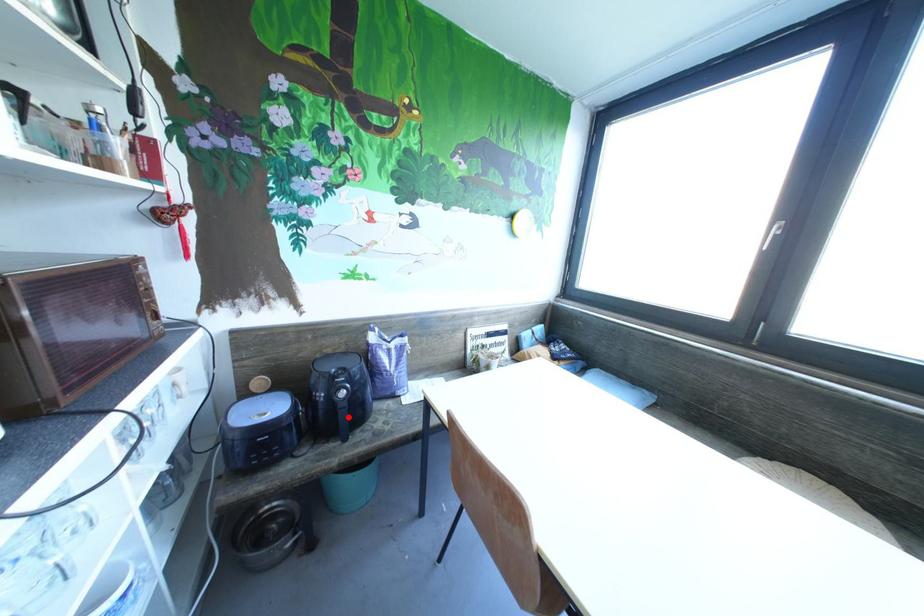
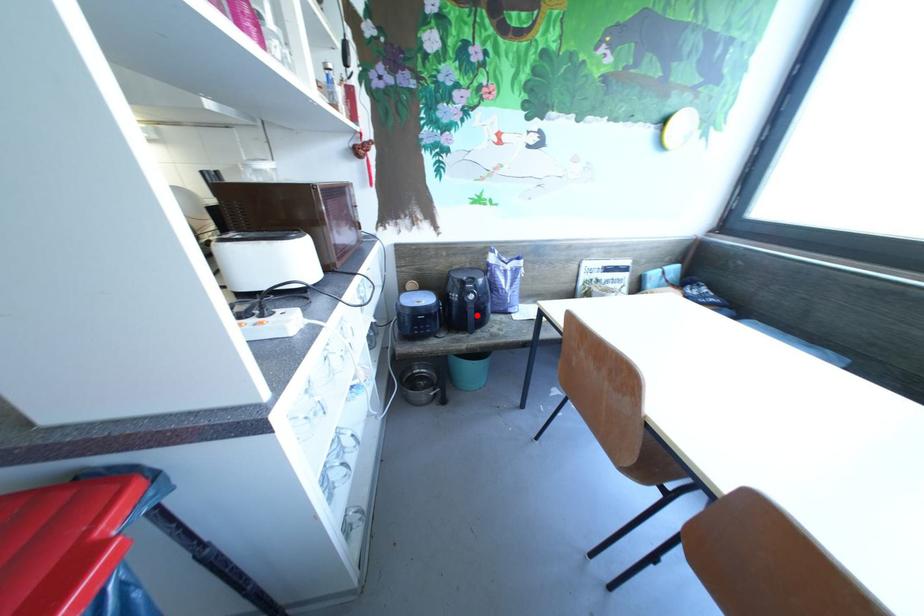
I am providing you with two images of the same scene from different viewpoints. A red point is marked on the first image and another point is marked on the second image. Is the marked point in image1 the same physical position as the marked point in image2?

Yes